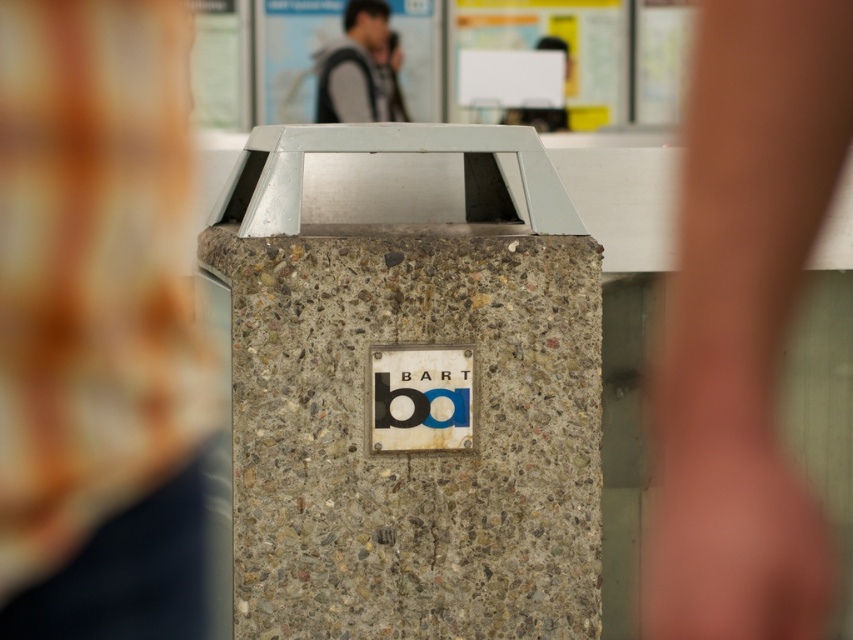
Question: Which object appears closest to the camera in this image?

Choices:
 (A) concrete textured pillar at center
 (B) gray fabric jacket at upper center

Answer: (A)

Question: Does concrete textured pillar at center lie in front of gray fabric jacket at upper center?

Choices:
 (A) yes
 (B) no

Answer: (A)

Question: Which is nearer to the gray fabric jacket at upper center?

Choices:
 (A) blue concrete sign at center
 (B) concrete textured pillar at center

Answer: (B)

Question: Can you confirm if gray fabric jacket at upper center is positioned above blue concrete sign at center?

Choices:
 (A) yes
 (B) no

Answer: (A)

Question: Is concrete textured pillar at center below blue concrete sign at center?

Choices:
 (A) no
 (B) yes

Answer: (A)

Question: Which point appears farthest from the camera in this image?

Choices:
 (A) (381, 4)
 (B) (427, 410)

Answer: (A)